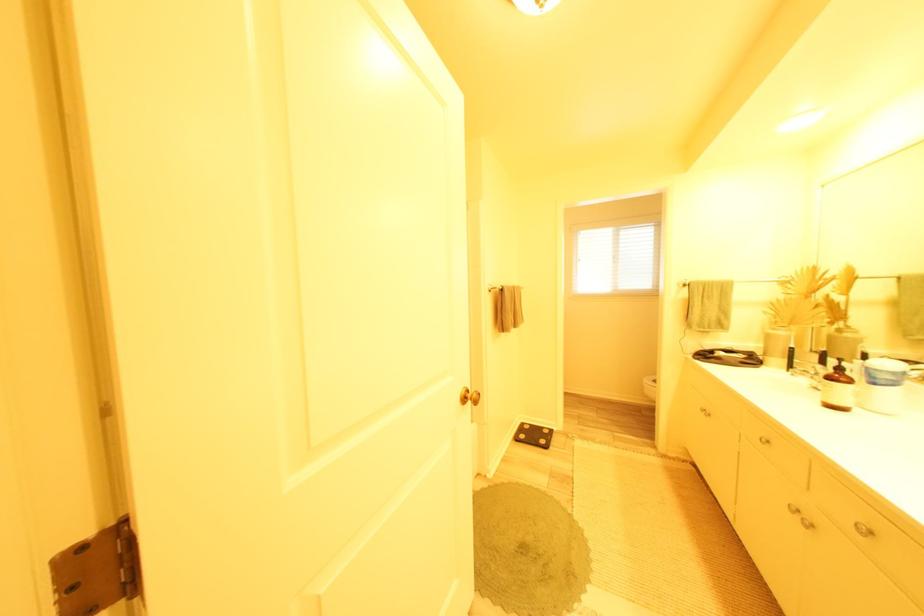
Describe the element at coordinates (883, 371) in the screenshot. This screenshot has height=616, width=924. I see `a blue jar lid` at that location.